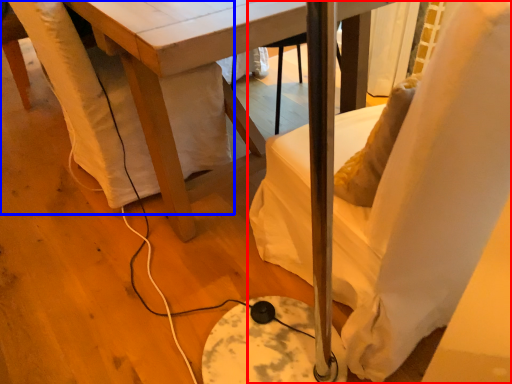
Question: Which of the following is the closest to the observer, chair (highlighted by a red box) or swivel chair (highlighted by a blue box)?

Choices:
 (A) chair
 (B) swivel chair

Answer: (A)